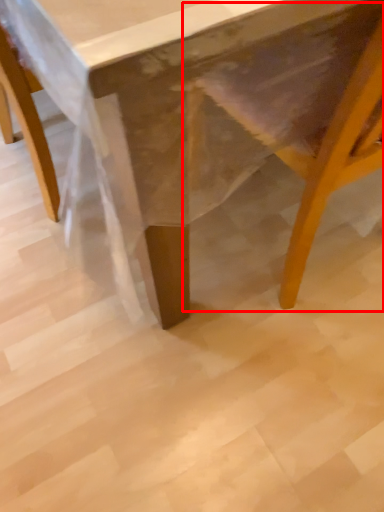
Question: Where is swivel chair (annotated by the red box) located in relation to table in the image?

Choices:
 (A) right
 (B) left

Answer: (A)